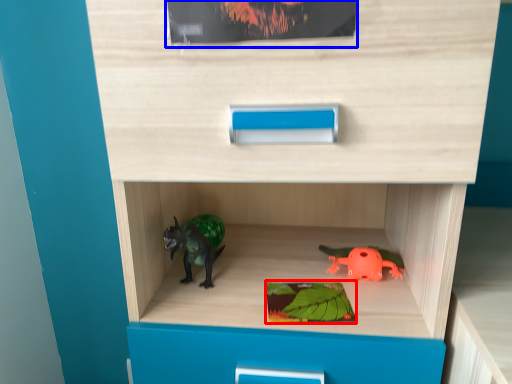
Question: Which object appears farthest to the camera in this image, paperback book (highlighted by a red box) or paperback book (highlighted by a blue box)?

Choices:
 (A) paperback book
 (B) paperback book

Answer: (A)